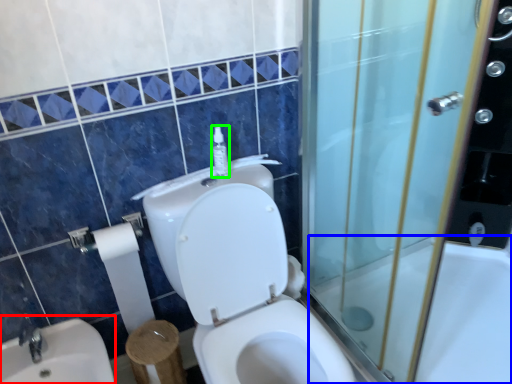
Question: Estimate the real-world distances between objects in this image. Which object is farther from sink (highlighted by a red box), bath (highlighted by a blue box) or soap dispenser (highlighted by a green box)?

Choices:
 (A) bath
 (B) soap dispenser

Answer: (A)